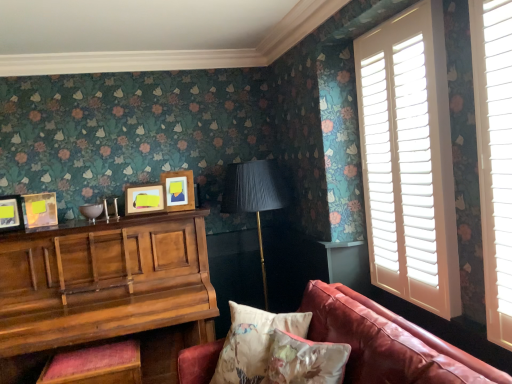
Question: From a real-world perspective, is leather couch at lower right on top of matte yellow picture frame at left, the 3th picture frame viewed from the right?

Choices:
 (A) yes
 (B) no

Answer: (B)

Question: Considering the relative sizes of leather couch at lower right and matte yellow picture frame at left, the 2th picture frame when ordered from left to right, in the image provided, is leather couch at lower right wider than matte yellow picture frame at left, the 2th picture frame when ordered from left to right,?

Choices:
 (A) yes
 (B) no

Answer: (A)

Question: Are leather couch at lower right and matte yellow picture frame at left, the 2th picture frame when ordered from left to right, located far from each other?

Choices:
 (A) no
 (B) yes

Answer: (B)

Question: Is leather couch at lower right to the left of matte yellow picture frame at left, the 3th picture frame viewed from the right, from the viewer's perspective?

Choices:
 (A) no
 (B) yes

Answer: (A)

Question: Does leather couch at lower right turn towards matte yellow picture frame at left, the 3th picture frame viewed from the right?

Choices:
 (A) no
 (B) yes

Answer: (A)

Question: Is leather couch at lower right looking in the opposite direction of matte yellow picture frame at left, the 2th picture frame when ordered from left to right?

Choices:
 (A) no
 (B) yes

Answer: (A)

Question: Can you confirm if wooden piano at left is smaller than leather couch at lower right?

Choices:
 (A) no
 (B) yes

Answer: (A)

Question: Is wooden piano at left oriented towards leather couch at lower right?

Choices:
 (A) no
 (B) yes

Answer: (B)

Question: Is wooden piano at left looking in the opposite direction of leather couch at lower right?

Choices:
 (A) yes
 (B) no

Answer: (B)

Question: Can you confirm if wooden piano at left is bigger than leather couch at lower right?

Choices:
 (A) no
 (B) yes

Answer: (B)

Question: Is wooden piano at left completely or partially outside of leather couch at lower right?

Choices:
 (A) yes
 (B) no

Answer: (A)

Question: Is leather couch at lower right located within wooden piano at left?

Choices:
 (A) no
 (B) yes

Answer: (A)

Question: Does matte wooden picture frame at center, which appears as the first picture frame when viewed from the right, have a greater height compared to matte yellow picture frame at left, the 3th picture frame viewed from the right?

Choices:
 (A) no
 (B) yes

Answer: (B)